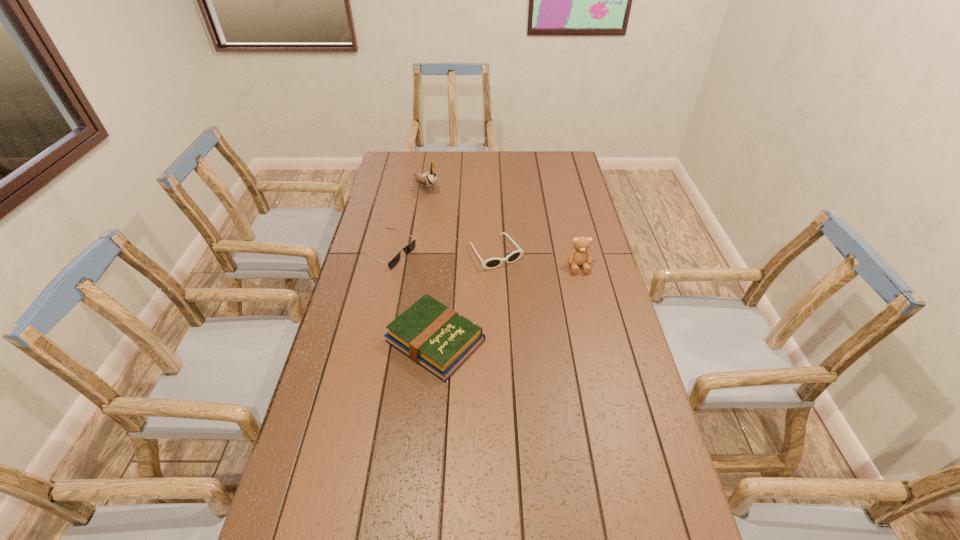
The image size is (960, 540). In order to click on book that is at the left edge in this screenshot , I will do `click(438, 338)`.

Locate an element on the screen. This screenshot has width=960, height=540. bird situated at the left edge is located at coordinates (429, 179).

Locate an element on the screen. sunglasses that is at the left edge is located at coordinates (410, 247).

Locate an element on the screen. object that is at the right edge is located at coordinates click(580, 256).

Locate an element on the screen. object at the far left corner is located at coordinates (429, 179).

Identify the location of blank space at the far edge of the desktop. (499, 161).

In the image, there is a desktop. Where is `vacant region at the left edge`? This screenshot has height=540, width=960. vacant region at the left edge is located at coordinates (389, 292).

Where is `vacant space at the right edge of the desktop`? This screenshot has width=960, height=540. vacant space at the right edge of the desktop is located at coordinates (558, 194).

Where is `vacant area at the far left corner of the desktop`? The height and width of the screenshot is (540, 960). vacant area at the far left corner of the desktop is located at coordinates (414, 153).

Where is `vacant area between the book and the right sunglasses`? The image size is (960, 540). vacant area between the book and the right sunglasses is located at coordinates (466, 296).